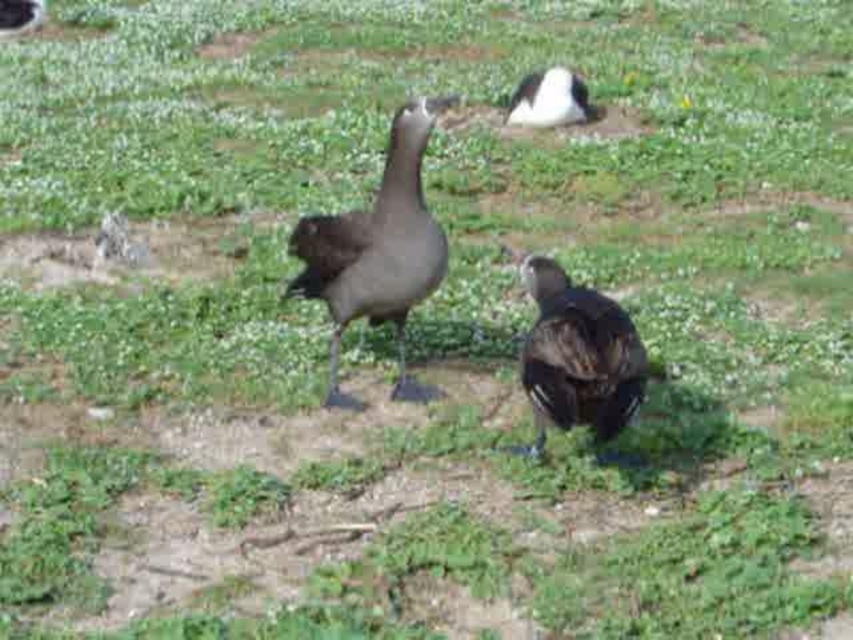
Question: Is dark gray matte duck at center wider than dark brown feathers at center?

Choices:
 (A) yes
 (B) no

Answer: (A)

Question: Can you confirm if dark gray matte duck at center is positioned to the right of dark brown feathers at center?

Choices:
 (A) no
 (B) yes

Answer: (A)

Question: Considering the real-world distances, which object is closest to the dark gray matte duck at center?

Choices:
 (A) dark brown feathers at center
 (B) white fluffy duck at upper center

Answer: (A)

Question: Which of the following is the farthest from the observer?

Choices:
 (A) (535, 100)
 (B) (602, 433)

Answer: (A)

Question: Which point is farther to the camera?

Choices:
 (A) (587, 380)
 (B) (567, 113)

Answer: (B)

Question: Considering the relative positions of dark gray matte duck at center and dark brown feathers at center in the image provided, where is dark gray matte duck at center located with respect to dark brown feathers at center?

Choices:
 (A) left
 (B) right

Answer: (A)